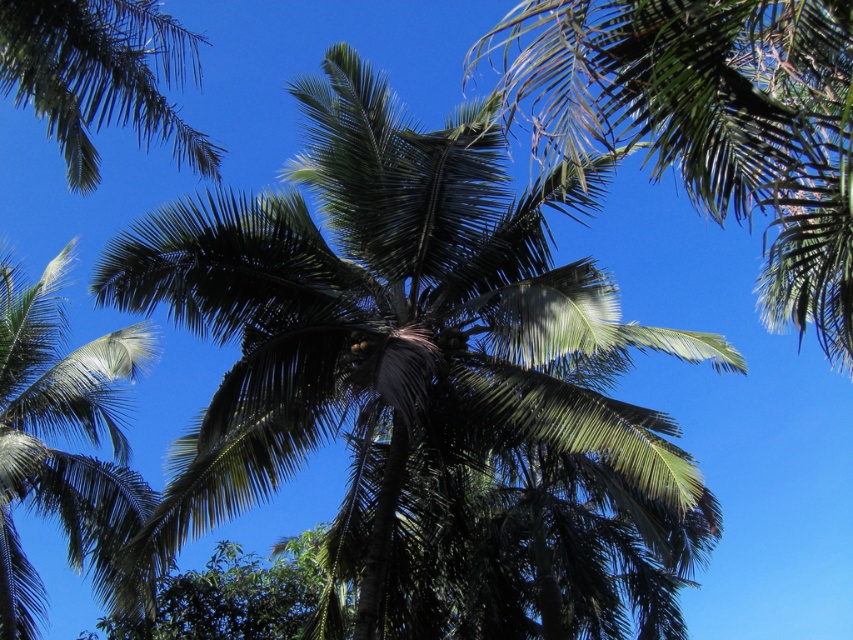
You are planning to plant a new tree in your backyard. You have space for only one large tree. Given the scene, which tree would you choose between the green leafy coconut tree at center and the green leafy palm tree at left, and why?

You should choose the green leafy palm tree at left because the green leafy coconut tree at center is bigger and might not fit in your space. Since you have space for only one large tree, the palm tree at left is a better fit as it is smaller in size compared to the coconut tree at center.

You are standing in the tropical scene and want to walk from the point closer to you to the farther point. Which path would you take between the two points, point (x=677, y=22) and point (x=6, y=445)?

The path from point (x=677, y=22) to point (x=6, y=445) would involve moving from the closer point to the farther one, as point (x=677, y=22) is nearer to the viewer compared to point (x=6, y=445).

You are standing in the tropical scene and want to identify the bigger palm tree between the green leafy palm tree at left and the green leafy palm at upper left. Which one should you point to?

The green leafy palm tree at left is larger in size than the green leafy palm at upper left, so you should point to the green leafy palm tree at left.